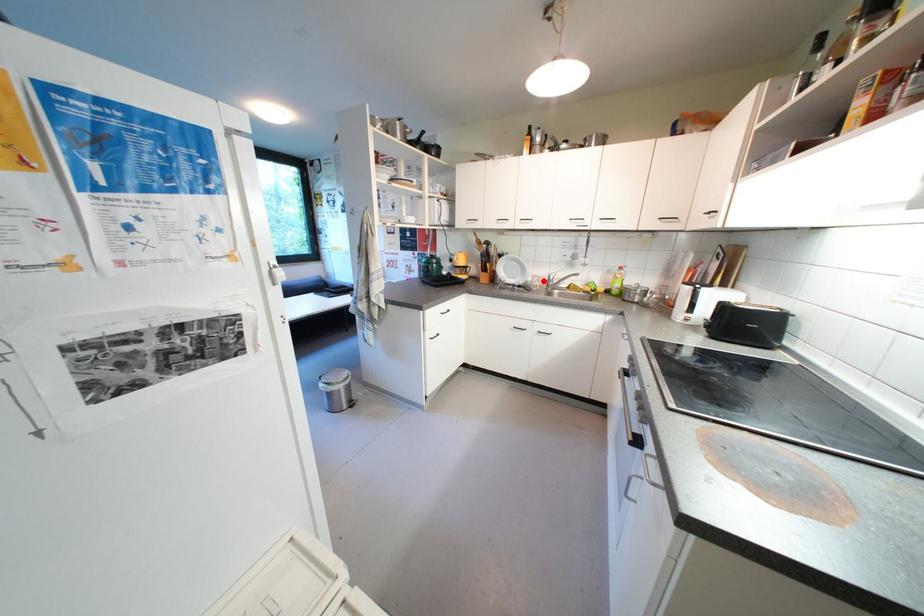
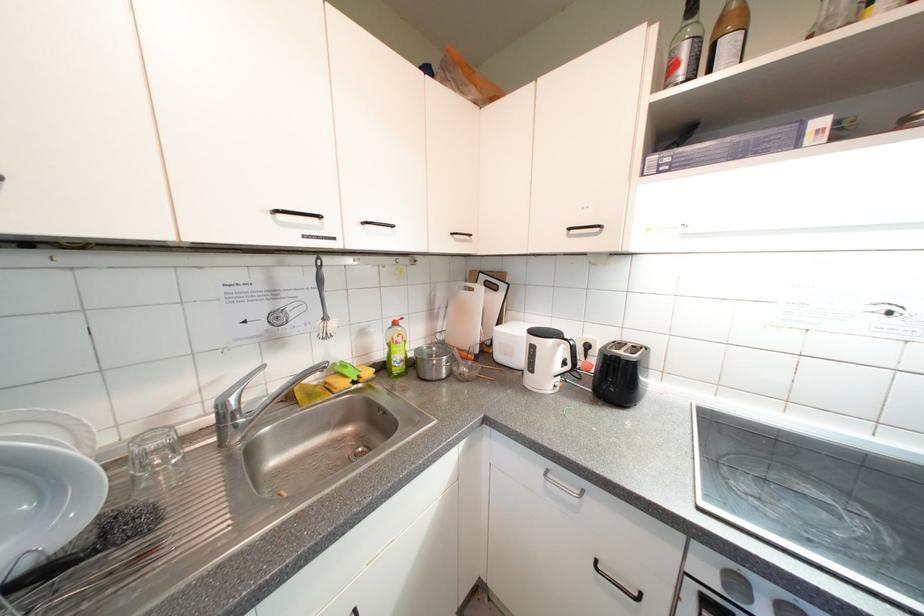
The point at the highlighted location is marked in the first image. Where is the corresponding point in the second image?

(162, 447)